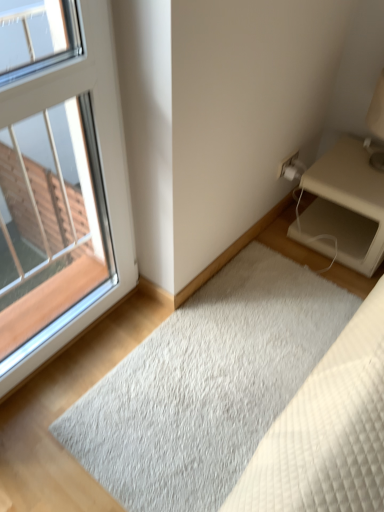
Question: In the image, is white shaggy rug at lower center positioned in front of or behind beige matte nightstand at right?

Choices:
 (A) front
 (B) behind

Answer: (A)

Question: In terms of size, does white shaggy rug at lower center appear bigger or smaller than beige matte nightstand at right?

Choices:
 (A) big
 (B) small

Answer: (B)

Question: Estimate the real-world distances between objects in this image. Which object is farther from the white plastic window at upper left?

Choices:
 (A) white shaggy rug at lower center
 (B) beige matte nightstand at right

Answer: (B)

Question: Considering the real-world distances, which object is closest to the beige matte nightstand at right?

Choices:
 (A) white shaggy rug at lower center
 (B) white plastic window at upper left

Answer: (A)